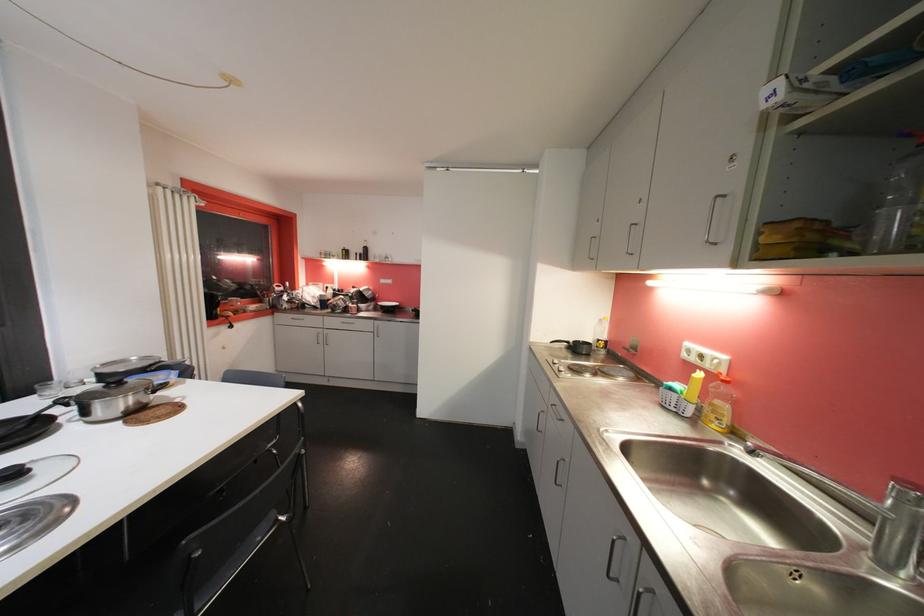
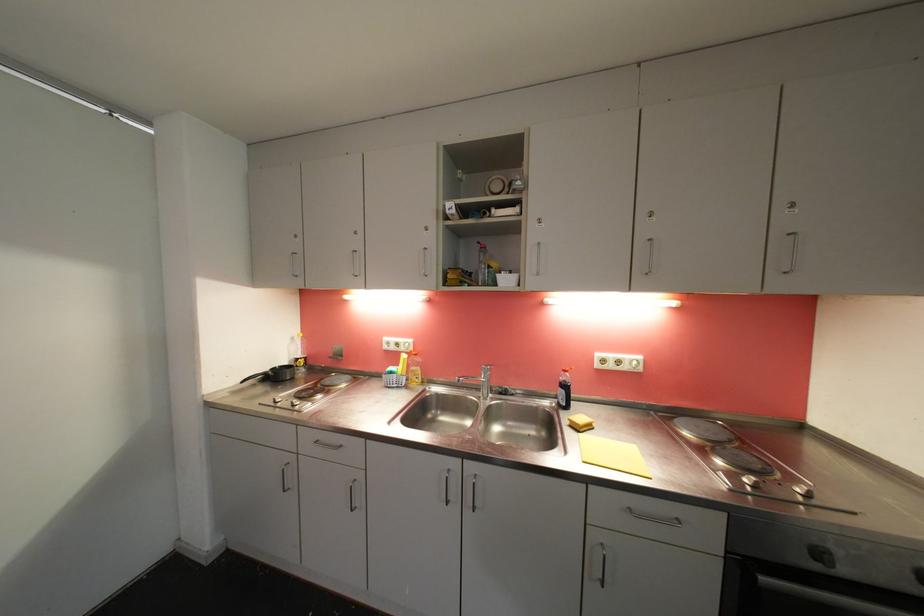
Question: The camera is either moving clockwise (left) or counter-clockwise (right) around the object. The first image is from the beginning of the video and the second image is from the end. Is the camera moving left or right when shooting the video?

Choices:
 (A) Left
 (B) Right

Answer: (A)